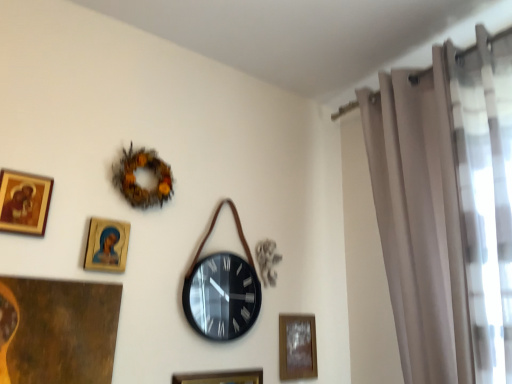
Question: Would you say brown textured wreath at upper center is to the left or to the right of black matte wall clock at center in the picture?

Choices:
 (A) right
 (B) left

Answer: (B)

Question: In terms of size, does brown textured wreath at upper center appear bigger or smaller than black matte wall clock at center?

Choices:
 (A) big
 (B) small

Answer: (B)

Question: Which is farther from the wooden picture frame at lower center, positioned as the 3th picture frame in front-to-back order?

Choices:
 (A) beige sheer curtain at right
 (B) wooden glossy picture frame at upper left, which is the 2th picture frame in top-to-bottom order
 (C) gold-framed picture at upper left, the 4th picture frame viewed from the back
 (D) black matte wall clock at center
 (E) wooden frame at lower center, the 1th picture frame when ordered from right to left

Answer: (A)

Question: Which of these objects is positioned farthest from the wooden glossy picture frame at upper left, which is the 2th picture frame in top-to-bottom order?

Choices:
 (A) gold-framed picture at upper left, the fourth picture frame in the right-to-left sequence
 (B) black matte wall clock at center
 (C) wooden picture frame at lower center, positioned as the 3th picture frame in front-to-back order
 (D) brown textured wreath at upper center
 (E) wooden frame at lower center, the 1th picture frame when ordered from right to left

Answer: (E)